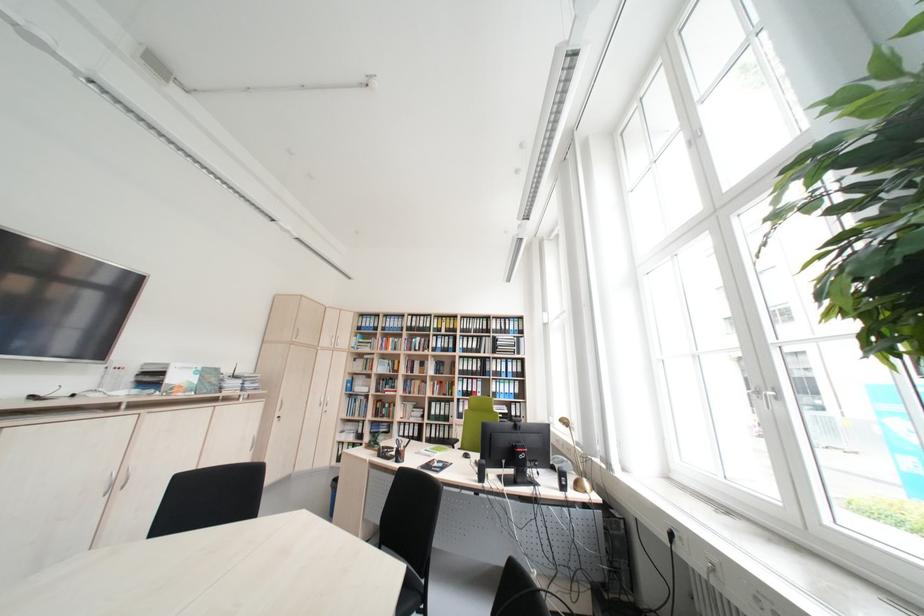
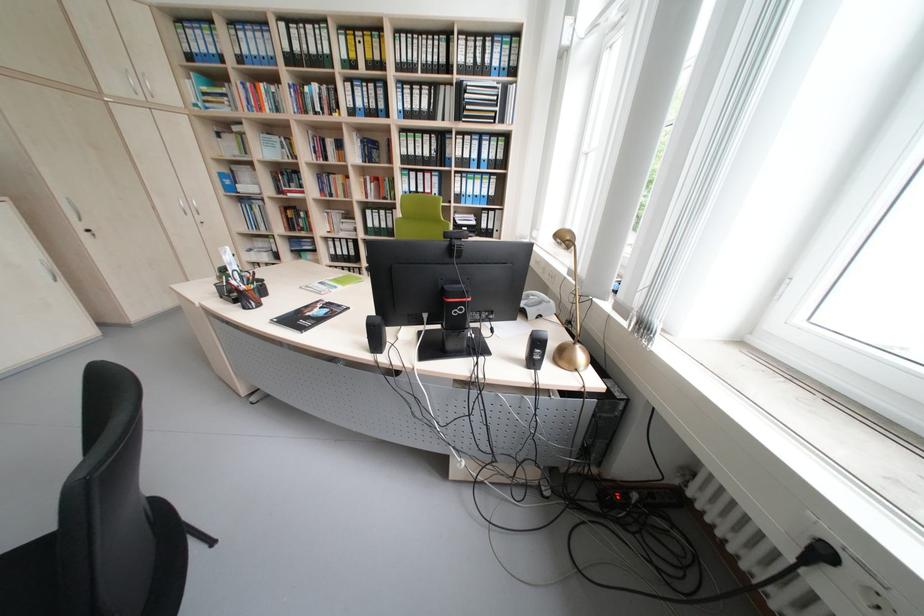
Find the pixel in the second image that matches pixel 394 407 in the first image.

(309, 217)